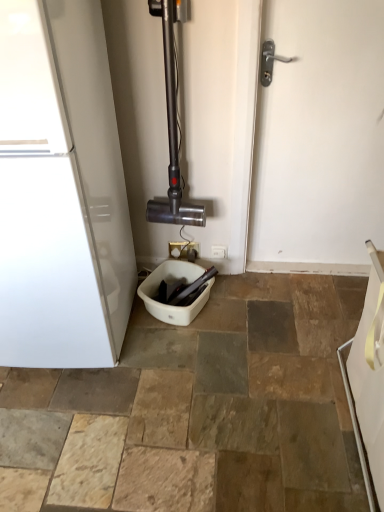
Question: Is white glossy refrigerator at left in front of or behind white plastic electric outlet at center, the 2th electric outlet from the left, in the image?

Choices:
 (A) front
 (B) behind

Answer: (A)

Question: Is white glossy refrigerator at left bigger or smaller than white plastic electric outlet at center, the 2th electric outlet from the left?

Choices:
 (A) small
 (B) big

Answer: (B)

Question: Estimate the real-world distances between objects in this image. Which object is closer to the white plastic toilet bowl at center?

Choices:
 (A) white matte door at center
 (B) white plastic electric outlet at center, the first electric outlet positioned from the right
 (C) white glossy towel at lower right
 (D) metallic vacuum cleaner at center
 (E) white plastic electric outlet at center, which is counted as the first electric outlet, starting from the left

Answer: (E)

Question: Estimate the real-world distances between objects in this image. Which object is closer to the white glossy refrigerator at left?

Choices:
 (A) white plastic electric outlet at center, which is counted as the first electric outlet, starting from the left
 (B) white plastic electric outlet at center, the first electric outlet positioned from the right
 (C) white plastic toilet bowl at center
 (D) white glossy towel at lower right
 (E) white matte door at center

Answer: (C)